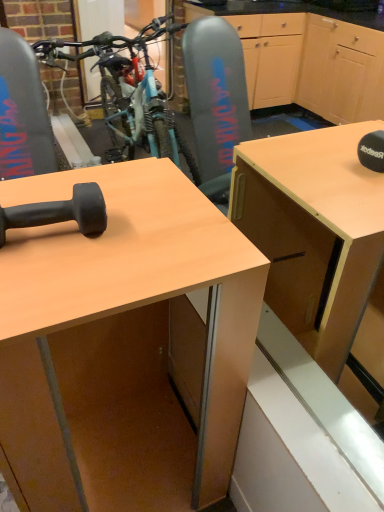
At what (x,y) coordinates should I click in order to perform the action: click on vacant area that is in front of black rubber dumbbell at lower left. Please return your answer as a coordinate pair (x, y). The width and height of the screenshot is (384, 512). Looking at the image, I should click on (43, 284).